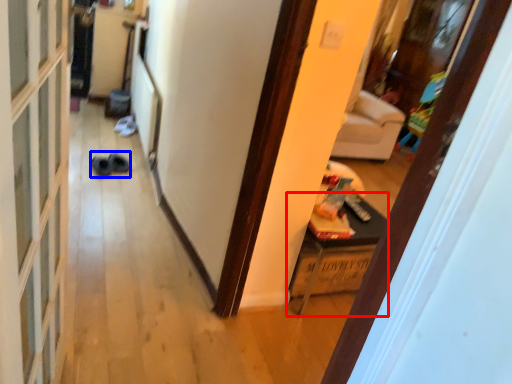
Question: Which point is further to the camera, furniture (highlighted by a red box) or shoe (highlighted by a blue box)?

Choices:
 (A) furniture
 (B) shoe

Answer: (B)